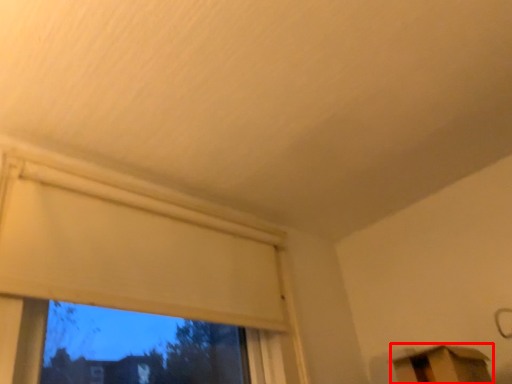
Question: In this image, where is furniture (annotated by the red box) located relative to window?

Choices:
 (A) left
 (B) right

Answer: (B)